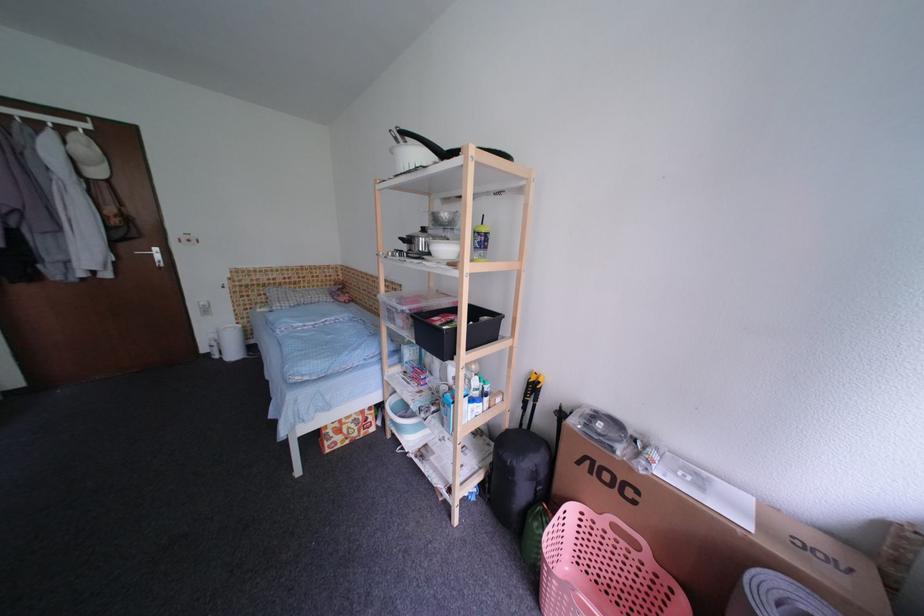
I want to click on black pot handle, so click(419, 140).